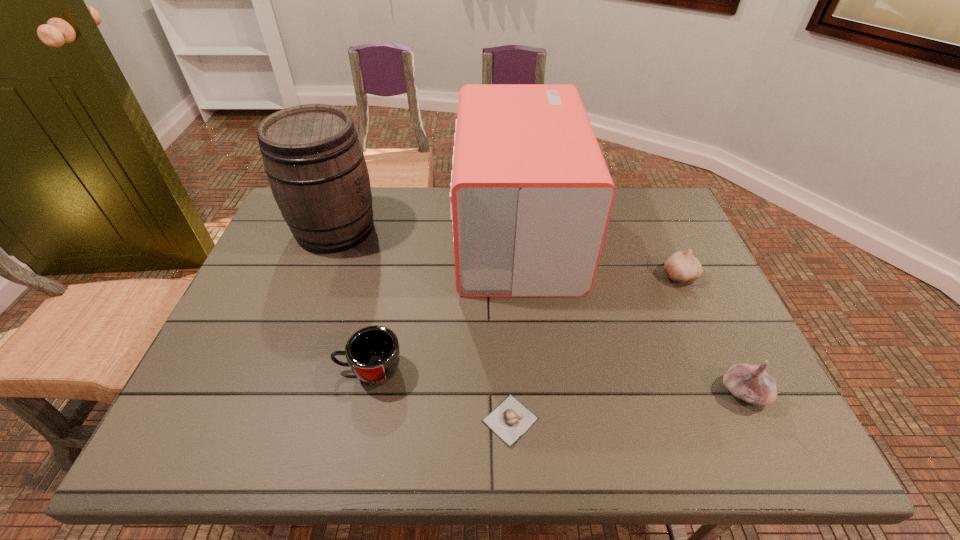
Where is `blank area in the image that satisfies the following two spatial constraints: 1. on the front side of the second shortest garlic; 2. on the right side of the tallest garlic`? The width and height of the screenshot is (960, 540). blank area in the image that satisfies the following two spatial constraints: 1. on the front side of the second shortest garlic; 2. on the right side of the tallest garlic is located at coordinates (732, 393).